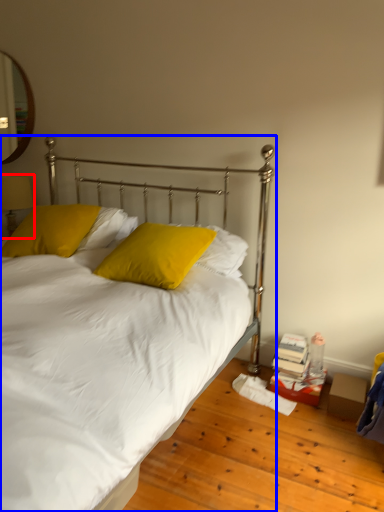
Question: Which of the following is the closest to the observer, table lamp (highlighted by a red box) or bed (highlighted by a blue box)?

Choices:
 (A) table lamp
 (B) bed

Answer: (B)